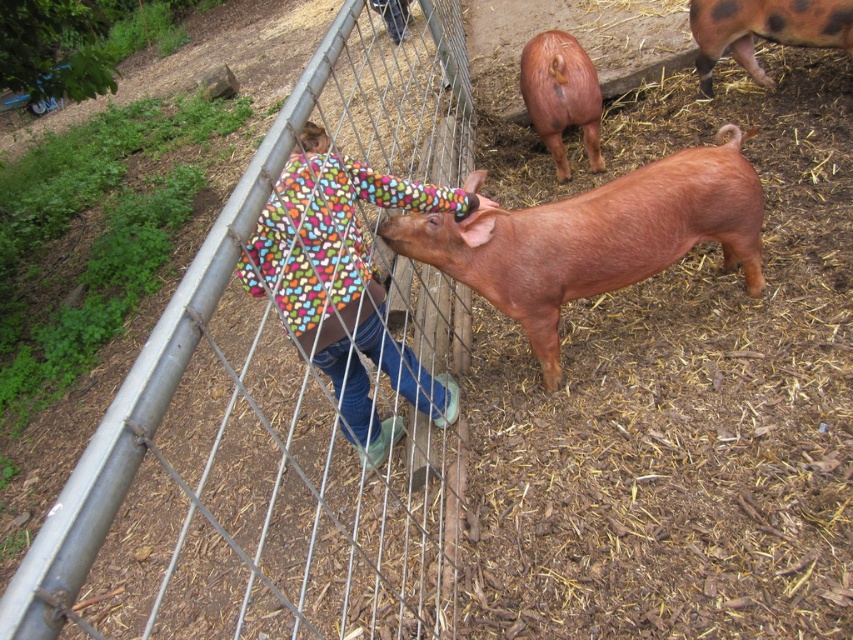
You are standing at the origin point of the coordinate system. The multicolored fleece jacket at center is at point (345, 284). If you want to walk directly to the multicolored fleece jacket at center, which direction should you head?

You should head northeast to reach the multicolored fleece jacket at center located at point (345, 284).

You are a farmer standing at the fence and want to feed the brown matte pig at center. If your arm can reach 1.5 meters, can you reach the pig?

The brown matte pig at center and the viewer are 3.46 meters apart, so no, you cannot reach the pig with an arm length of 1.5 meters.